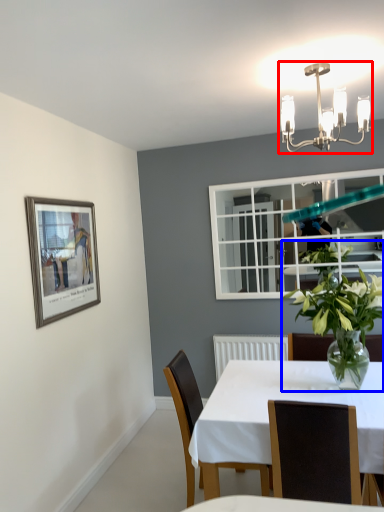
Question: Among these objects, which one is nearest to the camera, light fixture (highlighted by a red box) or houseplant (highlighted by a blue box)?

Choices:
 (A) light fixture
 (B) houseplant

Answer: (A)